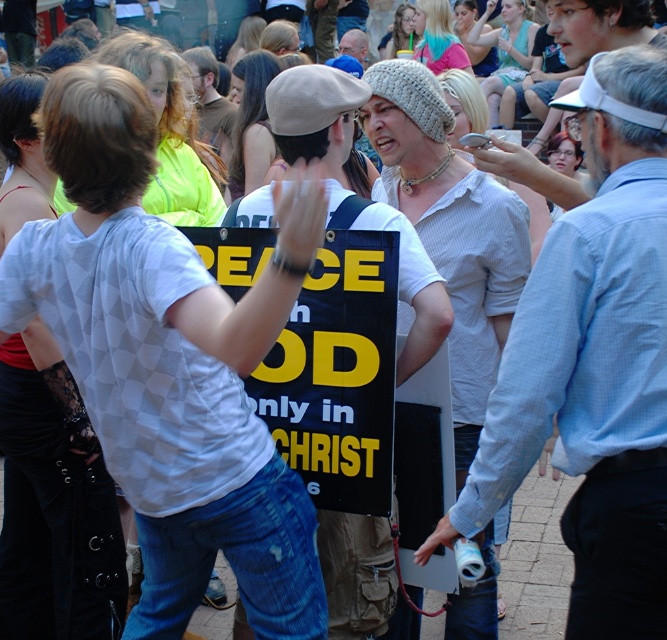
Does point (155, 173) come behind point (436, 56)?

No, (155, 173) is in front of (436, 56).

Is point (195, 192) less distant than point (430, 29)?

Yes, point (195, 192) is closer to viewer.

Locate an element on the screen. light brown hair at upper left is located at coordinates (169, 132).

Between blue denim shirt at upper center and matte black hair at center, which one has more height?

blue denim shirt at upper center is taller.

Locate an element on the screen. The height and width of the screenshot is (640, 667). blue denim shirt at upper center is located at coordinates (438, 36).

Does light blue shirt at center appear over smooth beige beret at center?

No, light blue shirt at center is not above smooth beige beret at center.

Which is above, light blue shirt at center or smooth beige beret at center?

smooth beige beret at center is higher up.

Identify the location of light blue shirt at center. (592, 385).